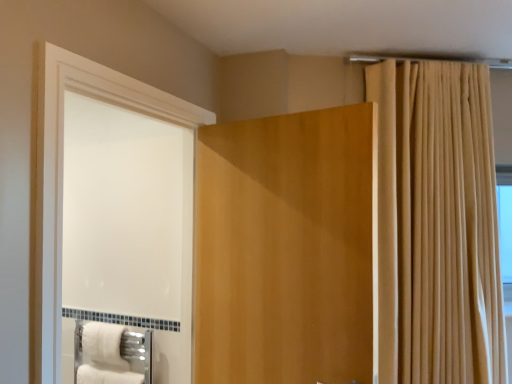
Question: Is beige fabric curtain at upper right next to white glossy screen door at left and touching it?

Choices:
 (A) no
 (B) yes

Answer: (A)

Question: Is beige fabric curtain at upper right not within white glossy screen door at left?

Choices:
 (A) yes
 (B) no

Answer: (A)

Question: Considering the relative positions of beige fabric curtain at upper right and white glossy screen door at left in the image provided, is beige fabric curtain at upper right in front of white glossy screen door at left?

Choices:
 (A) no
 (B) yes

Answer: (A)

Question: Does beige fabric curtain at upper right lie behind white glossy screen door at left?

Choices:
 (A) no
 (B) yes

Answer: (B)

Question: From the image's perspective, does beige fabric curtain at upper right appear lower than white glossy screen door at left?

Choices:
 (A) yes
 (B) no

Answer: (B)

Question: Could you tell me if beige fabric curtain at upper right is turned towards white glossy screen door at left?

Choices:
 (A) yes
 (B) no

Answer: (B)

Question: Is white glossy screen door at left shorter than beige fabric curtain at upper right?

Choices:
 (A) no
 (B) yes

Answer: (B)

Question: Is white glossy screen door at left turned away from beige fabric curtain at upper right?

Choices:
 (A) yes
 (B) no

Answer: (B)

Question: Is white glossy screen door at left thinner than beige fabric curtain at upper right?

Choices:
 (A) yes
 (B) no

Answer: (A)

Question: Is the depth of white glossy screen door at left less than that of beige fabric curtain at upper right?

Choices:
 (A) yes
 (B) no

Answer: (A)

Question: Is white glossy screen door at left further to the viewer compared to beige fabric curtain at upper right?

Choices:
 (A) no
 (B) yes

Answer: (A)

Question: Could you tell me if white glossy screen door at left is facing beige fabric curtain at upper right?

Choices:
 (A) no
 (B) yes

Answer: (A)

Question: Does white fluffy bath towel at lower left contain beige fabric curtain at upper right?

Choices:
 (A) no
 (B) yes

Answer: (A)